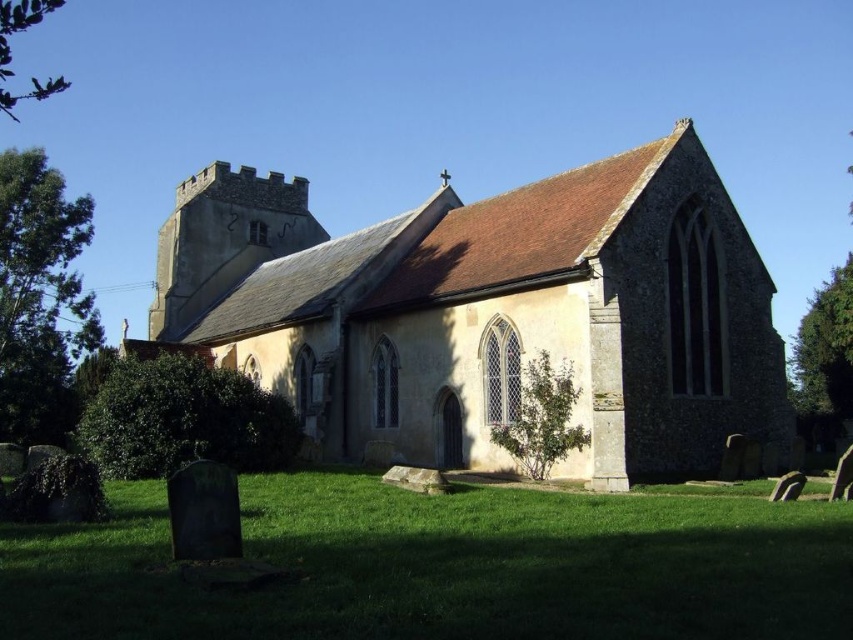
You are a visitor standing in front of the brown stone church at center and the green grass at lower center. Which object takes up more visual space in the image?

The brown stone church at center is bigger than the green grass at lower center, so it takes up more visual space in the image.

You are standing at the edge of the green grass at lower center, looking towards the brown stone church at center. Which object is taller?

The brown stone church at center is taller than the green grass at lower center.